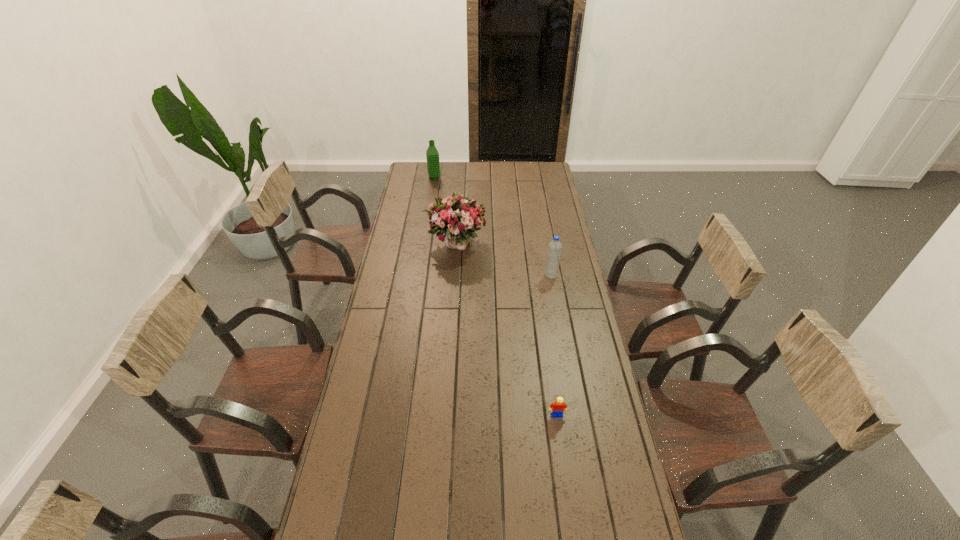
Identify which object is the nearest to the farthest object. Please provide its 2D coordinates. Your answer should be formatted as a tuple, i.e. [(x, y)], where the tuple contains the x and y coordinates of a point satisfying the conditions above.

[(457, 216)]

I want to click on the third closest object to the second object from right to left, so click(x=433, y=167).

I want to click on blank area in the image that satisfies the following two spatial constraints: 1. on the front side of the bouquet; 2. on the left side of the rightmost object, so click(453, 275).

I want to click on vacant space that satisfies the following two spatial constraints: 1. on the front side of the nearer water bottle; 2. on the right side of the third nearest object, so click(453, 275).

Find the location of a particular element. The width and height of the screenshot is (960, 540). vacant space that satisfies the following two spatial constraints: 1. on the front side of the left water bottle; 2. on the right side of the second nearest object is located at coordinates (420, 275).